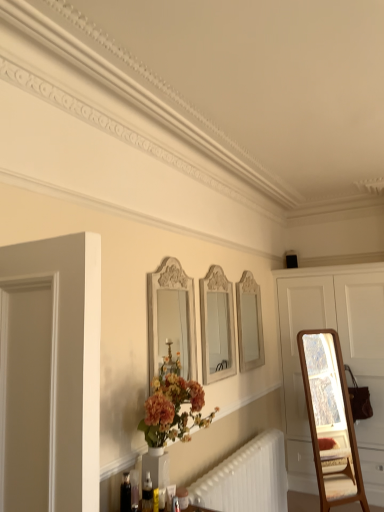
Find the location of a particular element. The image size is (384, 512). white carved wood mirror at center, which ranks as the 3th mirror in right-to-left order is located at coordinates (171, 317).

This screenshot has width=384, height=512. Describe the element at coordinates (343, 359) in the screenshot. I see `white wooden dresser at right` at that location.

What do you see at coordinates (217, 326) in the screenshot?
I see `white glossy mirror at center, the second mirror in the left-to-right sequence` at bounding box center [217, 326].

Identify the location of white carved wood mirror at center, the first mirror in the front-to-back sequence. This screenshot has width=384, height=512. (171, 317).

Measure the distance between white carved wood mirror at center, the third mirror from the back, and white glossy mirror at upper center, marked as the first mirror in a back-to-front arrangement.

white carved wood mirror at center, the third mirror from the back, is 97.11 centimeters from white glossy mirror at upper center, marked as the first mirror in a back-to-front arrangement.

Locate an element on the screen. the 2nd mirror directly above the white glossy mirror at upper center, marked as the first mirror in a back-to-front arrangement (from a real-world perspective) is located at coordinates (171, 317).

Which of these two, white carved wood mirror at center, which ranks as the 3th mirror in right-to-left order, or white glossy mirror at upper center, which is the third mirror in front-to-back order, stands taller?

Standing taller between the two is white glossy mirror at upper center, which is the third mirror in front-to-back order.

Are white carved wood mirror at center, the first mirror when ordered from left to right, and white glossy mirror at upper center, marked as the first mirror in a back-to-front arrangement, making contact?

No, white carved wood mirror at center, the first mirror when ordered from left to right, is not in contact with white glossy mirror at upper center, marked as the first mirror in a back-to-front arrangement.

Between white carved wood mirror at center, which ranks as the 3th mirror in right-to-left order, and translucent plastic bottle at lower center, which one has larger size?

white carved wood mirror at center, which ranks as the 3th mirror in right-to-left order.

Which of these two, white carved wood mirror at center, which ranks as the 3th mirror in right-to-left order, or translucent plastic bottle at lower center, stands taller?

With more height is white carved wood mirror at center, which ranks as the 3th mirror in right-to-left order.

From the image's perspective, between white carved wood mirror at center, which ranks as the 3th mirror in right-to-left order, and translucent plastic bottle at lower center, who is located below?

translucent plastic bottle at lower center is shown below in the image.

Choose the correct answer: Is white carved wood mirror at center, the first mirror when ordered from left to right, inside translucent plastic bottle at lower center or outside it?

white carved wood mirror at center, the first mirror when ordered from left to right, is not inside translucent plastic bottle at lower center, it's outside.

Is translucent plastic bottle at lower center to the left or to the right of white glossy mirror at center, the second mirror in the left-to-right sequence, in the image?

Clearly, translucent plastic bottle at lower center is on the left of white glossy mirror at center, the second mirror in the left-to-right sequence, in the image.

Would you say white glossy mirror at center, the second mirror in the left-to-right sequence, is part of translucent plastic bottle at lower center's contents?

That's incorrect, white glossy mirror at center, the second mirror in the left-to-right sequence, is not inside translucent plastic bottle at lower center.

Is translucent plastic bottle at lower center oriented away from white glossy mirror at center, which is the second mirror from right to left?

No, translucent plastic bottle at lower center is not facing the opposite direction of white glossy mirror at center, which is the second mirror from right to left.

Locate an element on the screen. This screenshot has height=512, width=384. toiletry in front of the white glossy mirror at center, the second mirror in the left-to-right sequence is located at coordinates (147, 494).

In the scene shown: Is translucent plastic bottle at lower center oriented away from white glossy mirror at upper center, the third mirror from the left?

translucent plastic bottle at lower center does not have its back to white glossy mirror at upper center, the third mirror from the left.

From the translucent plastic bottle at lower center, count 3rd mirror to the right and point to it. Please provide its 2D coordinates.

[(249, 323)]

Considering the sizes of objects translucent plastic bottle at lower center and white glossy mirror at upper center, the third mirror from the left, in the image provided, who is bigger, translucent plastic bottle at lower center or white glossy mirror at upper center, the third mirror from the left,?

white glossy mirror at upper center, the third mirror from the left, is bigger.

Looking at this image, from a real-world perspective, is translucent plastic bottle at lower center positioned under white glossy mirror at upper center, the third mirror from the left, based on gravity?

Indeed, from a real-world perspective, translucent plastic bottle at lower center is positioned beneath white glossy mirror at upper center, the third mirror from the left.

There is a white wooden dresser at right. In order to click on the 3rd mirror above it (from the image's perspective) in this screenshot , I will do `click(171, 317)`.

Which is behind, white wooden dresser at right or white carved wood mirror at center, the first mirror in the front-to-back sequence?

white wooden dresser at right is behind.

Can you confirm if white wooden dresser at right is wider than white carved wood mirror at center, the third mirror from the back?

Correct, the width of white wooden dresser at right exceeds that of white carved wood mirror at center, the third mirror from the back.

Which of these two, white wooden dresser at right or white carved wood mirror at center, the first mirror when ordered from left to right, is smaller?

With smaller size is white carved wood mirror at center, the first mirror when ordered from left to right.

From a real-world perspective, between translucent plastic bottle at lower center and white wooden dresser at right, who is vertically lower?

From a 3D spatial view, translucent plastic bottle at lower center is below.

Considering their positions, is translucent plastic bottle at lower center located in front of or behind white wooden dresser at right?

In the image, translucent plastic bottle at lower center appears in front of white wooden dresser at right.

Does translucent plastic bottle at lower center have a larger size compared to white wooden dresser at right?

Incorrect, translucent plastic bottle at lower center is not larger than white wooden dresser at right.

From a real-world perspective, is white glossy mirror at center, the second mirror in the left-to-right sequence, located higher than white glossy mirror at upper center, which is the third mirror in front-to-back order?

Indeed, from a real-world perspective, white glossy mirror at center, the second mirror in the left-to-right sequence, stands above white glossy mirror at upper center, which is the third mirror in front-to-back order.

Which mirror is the 1st one when counting from the left side of the white glossy mirror at upper center, the third mirror from the left? Please provide its 2D coordinates.

[(217, 326)]

Is white glossy mirror at center, the second mirror in the left-to-right sequence, positioned far away from white glossy mirror at upper center, marked as the first mirror in a back-to-front arrangement?

No, white glossy mirror at center, the second mirror in the left-to-right sequence, is in close proximity to white glossy mirror at upper center, marked as the first mirror in a back-to-front arrangement.

From the image's perspective, count 2nd mirrors upward from the white glossy mirror at upper center, the third mirror from the left, and point to it. Please provide its 2D coordinates.

[(171, 317)]

Locate an element on the screen. toiletry that is on the left side of white carved wood mirror at center, the third mirror from the back is located at coordinates (147, 494).

From the picture: Looking at the image, which one is located further to white glossy mirror at center, which is the 2th mirror from back to front, translucent plastic bottle at lower center or white carved wood mirror at center, which ranks as the 3th mirror in right-to-left order?

translucent plastic bottle at lower center lies further to white glossy mirror at center, which is the 2th mirror from back to front, than the other object.

When comparing their distances from white glossy mirror at center, which is the second mirror from right to left, does white carved wood mirror at center, the third mirror from the back, or translucent plastic bottle at lower center seem closer?

white carved wood mirror at center, the third mirror from the back, is positioned closer to the anchor white glossy mirror at center, which is the second mirror from right to left.

Looking at the image, which one is located closer to white glossy mirror at center, which is the second mirror from right to left, white wooden dresser at right or translucent plastic bottle at lower center?

Among the two, translucent plastic bottle at lower center is located nearer to white glossy mirror at center, which is the second mirror from right to left.

From the image, which object appears to be farther from white glossy mirror at upper center, the third mirror from the left, white glossy mirror at center, which is the second mirror from right to left, or white carved wood mirror at center, the first mirror when ordered from left to right?

The object further to white glossy mirror at upper center, the third mirror from the left, is white carved wood mirror at center, the first mirror when ordered from left to right.

In the scene shown: Based on their spatial positions, is white glossy mirror at center, the second mirror in the front-to-back sequence, or white glossy mirror at upper center, which is counted as the first mirror, starting from the right, closer to white wooden dresser at right?

white glossy mirror at upper center, which is counted as the first mirror, starting from the right, is closer to white wooden dresser at right.

Based on their spatial positions, is translucent plastic bottle at lower center or white glossy mirror at center, the second mirror in the left-to-right sequence, closer to white glossy mirror at upper center, the third mirror from the left?

white glossy mirror at center, the second mirror in the left-to-right sequence, lies closer to white glossy mirror at upper center, the third mirror from the left, than the other object.

Estimate the real-world distances between objects in this image. Which object is closer to white glossy mirror at upper center, which is the third mirror in front-to-back order, white glossy mirror at center, which is the second mirror from right to left, or translucent plastic bottle at lower center?

white glossy mirror at center, which is the second mirror from right to left, is closer to white glossy mirror at upper center, which is the third mirror in front-to-back order.

Based on their spatial positions, is translucent plastic bottle at lower center or white carved wood mirror at center, the first mirror in the front-to-back sequence, further from white glossy mirror at upper center, the third mirror from the left?

The object further to white glossy mirror at upper center, the third mirror from the left, is translucent plastic bottle at lower center.

Locate an element on the screen. The width and height of the screenshot is (384, 512). mirror between white carved wood mirror at center, the first mirror in the front-to-back sequence, and white glossy mirror at upper center, which is counted as the first mirror, starting from the right, from front to back is located at coordinates (217, 326).

Image resolution: width=384 pixels, height=512 pixels. Find the location of `mirror located between translucent plastic bottle at lower center and white glossy mirror at center, the second mirror in the left-to-right sequence, in the depth direction`. mirror located between translucent plastic bottle at lower center and white glossy mirror at center, the second mirror in the left-to-right sequence, in the depth direction is located at coordinates 171,317.

Where is `mirror situated between white glossy mirror at center, the second mirror in the front-to-back sequence, and white wooden dresser at right from left to right`? This screenshot has height=512, width=384. mirror situated between white glossy mirror at center, the second mirror in the front-to-back sequence, and white wooden dresser at right from left to right is located at coordinates (249, 323).